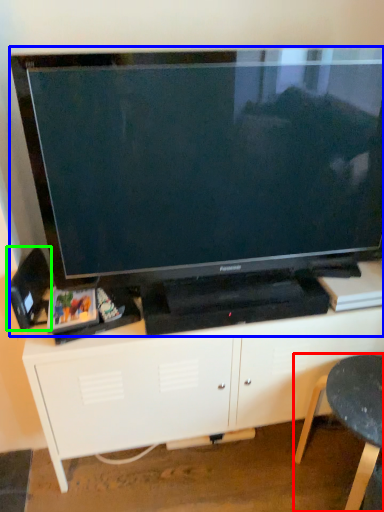
Question: Which is nearer to the furniture (highlighted by a red box)? television (highlighted by a blue box) or speaker (highlighted by a green box).

Choices:
 (A) television
 (B) speaker

Answer: (A)